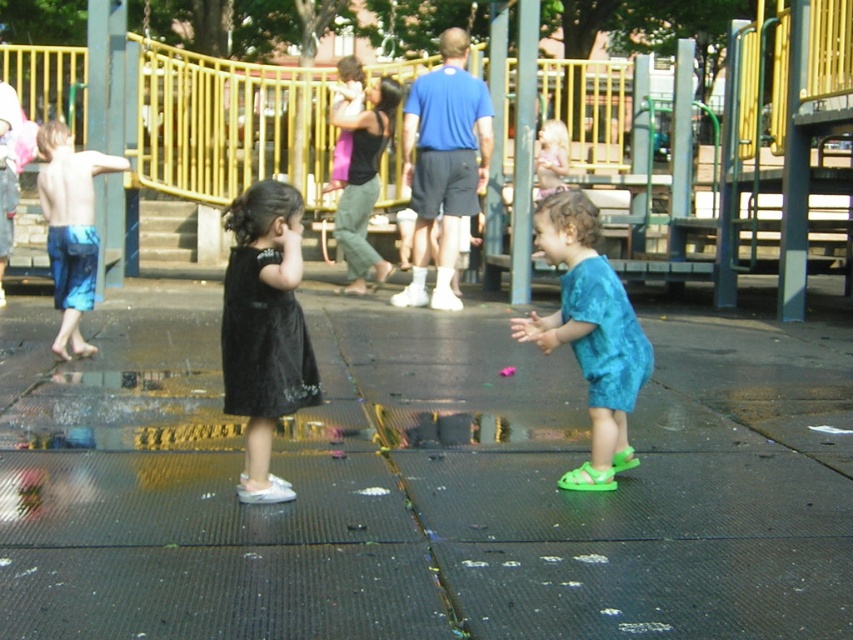
Is black satin dress at center wider than blue tie-dye shorts at left?

No.

The height and width of the screenshot is (640, 853). What do you see at coordinates (264, 330) in the screenshot?
I see `black satin dress at center` at bounding box center [264, 330].

Locate an element on the screen. The image size is (853, 640). black satin dress at center is located at coordinates (264, 330).

Can you confirm if black rubber pavement at center is wider than blue tie-dye shorts at left?

No, black rubber pavement at center is not wider than blue tie-dye shorts at left.

Is point (196, 458) positioned after point (61, 152)?

No, (196, 458) is closer to viewer.

Where is `black rubber pavement at center`? This screenshot has height=640, width=853. black rubber pavement at center is located at coordinates (422, 484).

Is teal fabric shirt at center behind light blue fabric dress at center?

No.

Can you confirm if teal fabric shirt at center is positioned to the right of light blue fabric dress at center?

In fact, teal fabric shirt at center is to the left of light blue fabric dress at center.

Who is more forward, (595, 337) or (560, 120)?

Point (595, 337) is in front.

In order to click on teal fabric shirt at center in this screenshot , I will do `click(590, 333)`.